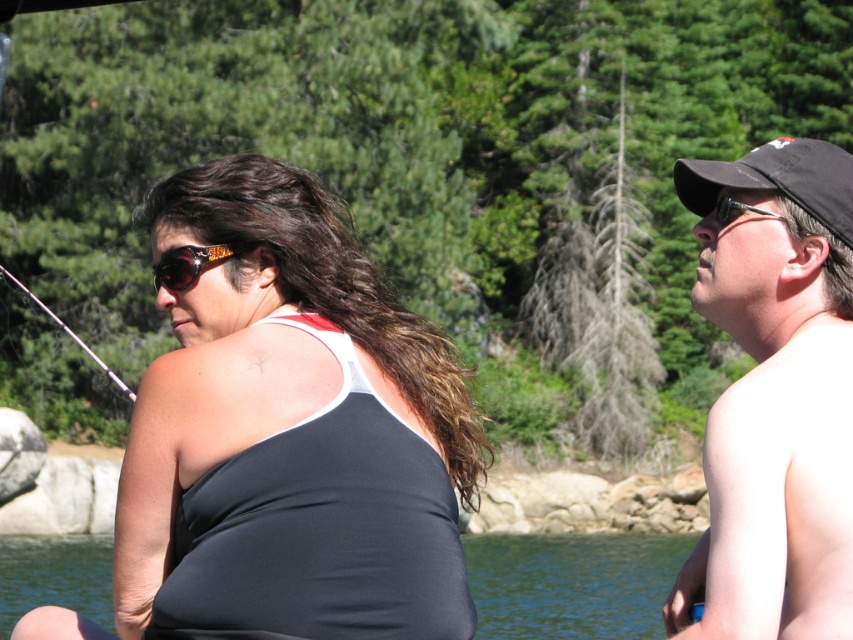
In the scene shown: Which is more to the left, black cap at right or transparent water at lower center?

transparent water at lower center is more to the left.

Is point (779, 168) farther from camera compared to point (524, 577)?

No, (779, 168) is in front of (524, 577).

Which is behind, point (747, 612) or point (540, 612)?

Point (540, 612)

Locate an element on the screen. The image size is (853, 640). black cap at right is located at coordinates [775, 394].

Which is in front, point (74, 573) or point (689, 189)?

Point (689, 189)

Between transparent water at lower center and black fabric baseball cap at right, which one appears on the right side from the viewer's perspective?

Positioned to the right is black fabric baseball cap at right.

At what (x,y) coordinates should I click in order to perform the action: click on transparent water at lower center. Please return your answer as a coordinate pair (x, y). This screenshot has height=640, width=853. Looking at the image, I should click on (572, 582).

Between black matte tank top at left and transparent water at lower center, which one is positioned lower?

transparent water at lower center is lower down.

Does black matte tank top at left appear on the left side of transparent water at lower center?

Yes, black matte tank top at left is to the left of transparent water at lower center.

Find the location of `black matte tank top at left`. black matte tank top at left is located at coordinates (289, 432).

You are a GUI agent. You are given a task and a screenshot of the screen. Output one action in this format:
    pyautogui.click(x=<x>, y=<y>)
    Task: Click on the black matte tank top at left
    This screenshot has width=853, height=640.
    Given the screenshot: What is the action you would take?
    pyautogui.click(x=289, y=432)